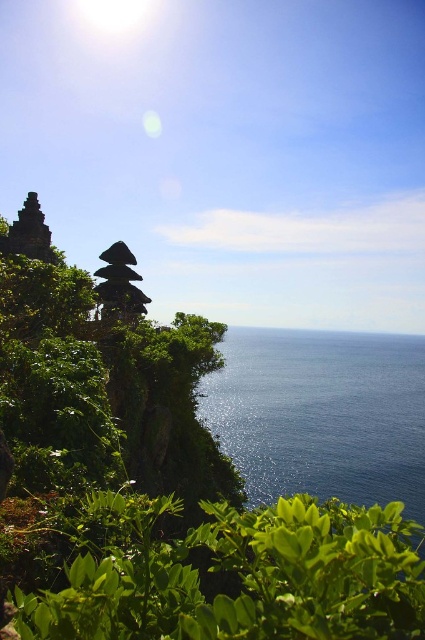
Question: Which point is farther from the camera taking this photo?

Choices:
 (A) (266, 419)
 (B) (104, 284)

Answer: (A)

Question: Which point appears farthest from the camera in this image?

Choices:
 (A) (272, 476)
 (B) (116, 268)

Answer: (A)

Question: Can you confirm if blue glossy water at lower center is positioned to the right of dark brown stone structure at center?

Choices:
 (A) yes
 (B) no

Answer: (A)

Question: From the image, what is the correct spatial relationship of blue glossy water at lower center in relation to dark brown stone structure at center?

Choices:
 (A) above
 (B) below

Answer: (B)

Question: Can you confirm if blue glossy water at lower center is bigger than dark brown stone structure at center?

Choices:
 (A) yes
 (B) no

Answer: (A)